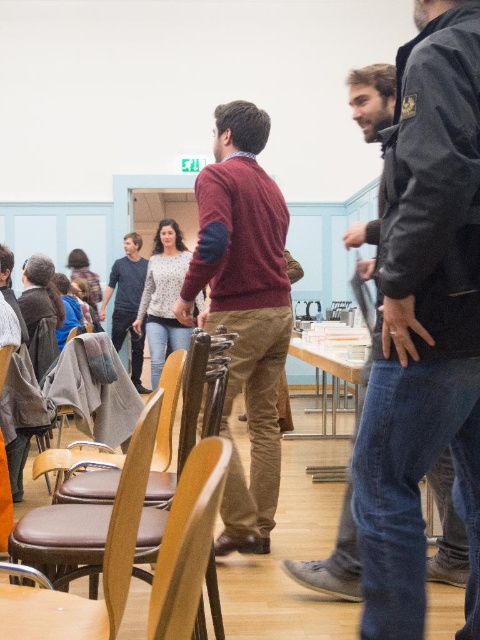
Question: Does maroon sweater at center have a larger size compared to speckled sweater at center?

Choices:
 (A) yes
 (B) no

Answer: (B)

Question: Which of the following is the farthest from the observer?

Choices:
 (A) (403, 556)
 (B) (360, 330)
 (C) (167, 256)

Answer: (C)

Question: Does dark gray jacket at right have a smaller size compared to speckled sweater at center?

Choices:
 (A) no
 (B) yes

Answer: (B)

Question: Can you confirm if dark gray jacket at right is positioned below maroon sweater at center?

Choices:
 (A) no
 (B) yes

Answer: (B)

Question: Among these objects, which one is farthest from the camera?

Choices:
 (A) dark gray jacket at right
 (B) maroon sweater at center

Answer: (B)

Question: Which point is closer to the camera?

Choices:
 (A) [x=152, y=369]
 (B) [x=310, y=474]

Answer: (B)